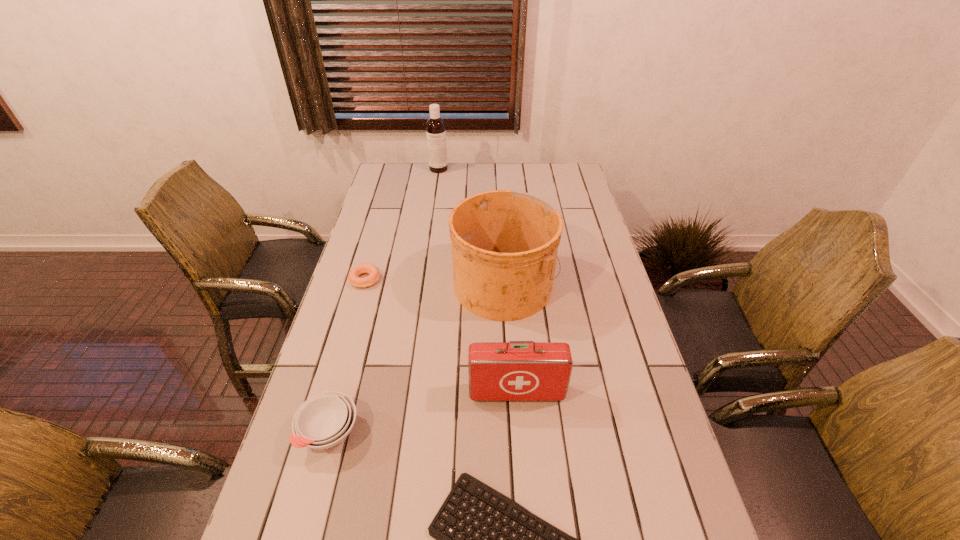
Locate an element on the screen. The height and width of the screenshot is (540, 960). vacant space located on the side of the first-aid kit with the first aid cross symbol is located at coordinates (518, 425).

The height and width of the screenshot is (540, 960). In order to click on vacant space located 0.270m on the right of the soup bowl in this screenshot , I will do `click(472, 431)`.

You are a GUI agent. You are given a task and a screenshot of the screen. Output one action in this format:
    pyautogui.click(x=<x>, y=<y>)
    Task: Click on the vacant space located 0.120m on the right of the bagel
    The width and height of the screenshot is (960, 540).
    Given the screenshot: What is the action you would take?
    pyautogui.click(x=417, y=279)

You are a GUI agent. You are given a task and a screenshot of the screen. Output one action in this format:
    pyautogui.click(x=<x>, y=<y>)
    Task: Click on the object positioned at the far edge
    The height and width of the screenshot is (540, 960).
    Given the screenshot: What is the action you would take?
    pyautogui.click(x=435, y=126)

The width and height of the screenshot is (960, 540). I want to click on soup bowl that is at the left edge, so click(324, 420).

The width and height of the screenshot is (960, 540). Find the location of `bagel that is at the left edge`. bagel that is at the left edge is located at coordinates (372, 270).

In the image, there is a desktop. Identify the location of vacant space at the left edge. (364, 366).

Identify the location of vacant space at the right edge of the desktop. The image size is (960, 540). (625, 350).

Image resolution: width=960 pixels, height=540 pixels. In the image, there is a desktop. Identify the location of vacant region at the far right corner. (560, 176).

Locate an element on the screen. The width and height of the screenshot is (960, 540). free spot between the farthest object and the fifth tallest object is located at coordinates point(401,224).